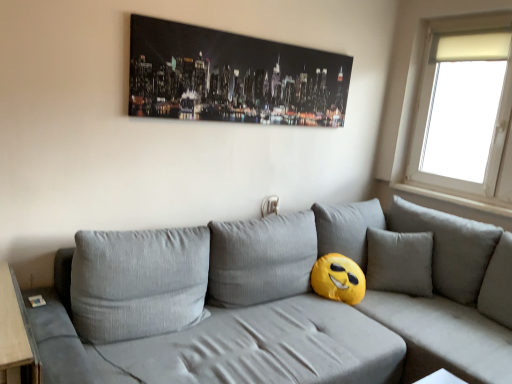
Question: Is textured gray couch at center shorter than white frosted glass window at upper right?

Choices:
 (A) yes
 (B) no

Answer: (A)

Question: Considering the relative positions of textured gray couch at center and white frosted glass window at upper right in the image provided, is textured gray couch at center to the right of white frosted glass window at upper right from the viewer's perspective?

Choices:
 (A) no
 (B) yes

Answer: (A)

Question: Is textured gray couch at center positioned far away from white frosted glass window at upper right?

Choices:
 (A) yes
 (B) no

Answer: (A)

Question: Does textured gray couch at center have a greater width compared to white frosted glass window at upper right?

Choices:
 (A) yes
 (B) no

Answer: (A)

Question: Is textured gray couch at center at the left side of white frosted glass window at upper right?

Choices:
 (A) yes
 (B) no

Answer: (A)

Question: From the image's perspective, would you say textured gray couch at center is positioned over white frosted glass window at upper right?

Choices:
 (A) yes
 (B) no

Answer: (B)

Question: From the image's perspective, is white frosted glass window at upper right above textured gray couch at center?

Choices:
 (A) no
 (B) yes

Answer: (B)

Question: Can you confirm if white frosted glass window at upper right is bigger than textured gray couch at center?

Choices:
 (A) yes
 (B) no

Answer: (B)

Question: From the image's perspective, is white frosted glass window at upper right below textured gray couch at center?

Choices:
 (A) yes
 (B) no

Answer: (B)

Question: Considering the relative sizes of white frosted glass window at upper right and textured gray couch at center in the image provided, is white frosted glass window at upper right taller than textured gray couch at center?

Choices:
 (A) no
 (B) yes

Answer: (B)

Question: From a real-world perspective, does white frosted glass window at upper right sit lower than textured gray couch at center?

Choices:
 (A) no
 (B) yes

Answer: (A)

Question: Is white frosted glass window at upper right further to camera compared to textured gray couch at center?

Choices:
 (A) yes
 (B) no

Answer: (A)

Question: Is white frosted glass window at upper right shorter than black glossy canvas at upper center?

Choices:
 (A) yes
 (B) no

Answer: (B)